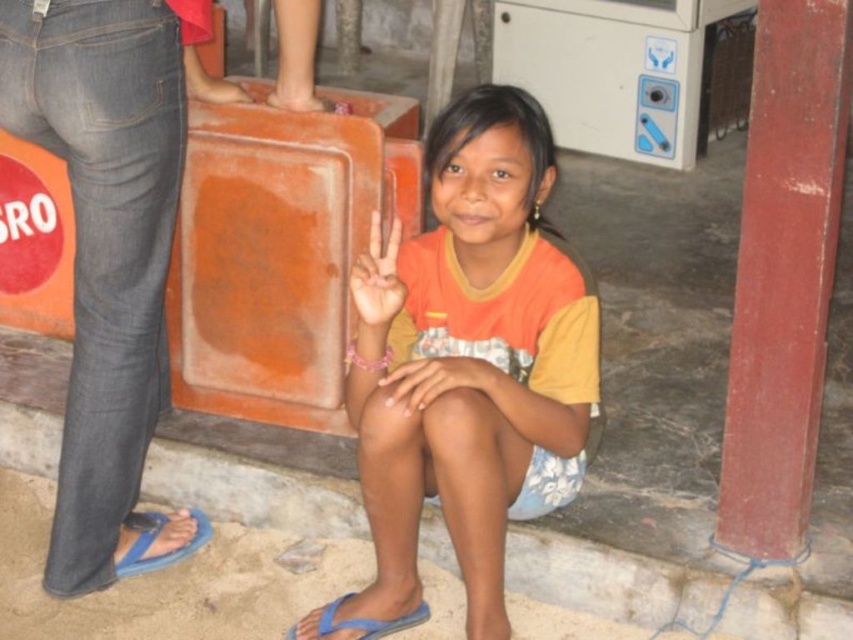
Question: Is the position of matte orange shirt at center more distant than that of blue rubber sandal at lower center?

Choices:
 (A) yes
 (B) no

Answer: (B)

Question: Based on their relative distances, which object is farther from the smooth skin hand at center?

Choices:
 (A) orange cotton shirt at center
 (B) matte orange shirt at center
 (C) blue rubber sandal at lower left
 (D) blue rubber sandal at lower center

Answer: (C)

Question: Does orange cotton shirt at center appear on the right side of blue rubber sandal at lower left?

Choices:
 (A) yes
 (B) no

Answer: (A)

Question: Which object appears closest to the camera in this image?

Choices:
 (A) orange cotton shirt at center
 (B) blue rubber sandal at lower center

Answer: (A)

Question: Does matte orange shirt at center appear on the left side of blue rubber sandal at lower center?

Choices:
 (A) no
 (B) yes

Answer: (A)

Question: Which object is closer to the camera taking this photo?

Choices:
 (A) denim jeans at left
 (B) smooth skin hand at center
 (C) blue rubber sandal at lower center
 (D) blue rubber sandal at lower left

Answer: (A)